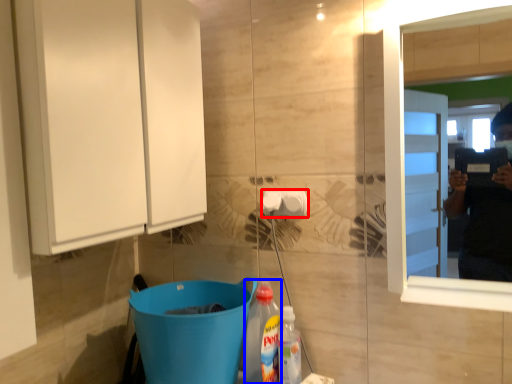
Question: Which of the following is the closest to the observer, towel bar (highlighted by a red box) or bottle (highlighted by a blue box)?

Choices:
 (A) towel bar
 (B) bottle

Answer: (B)